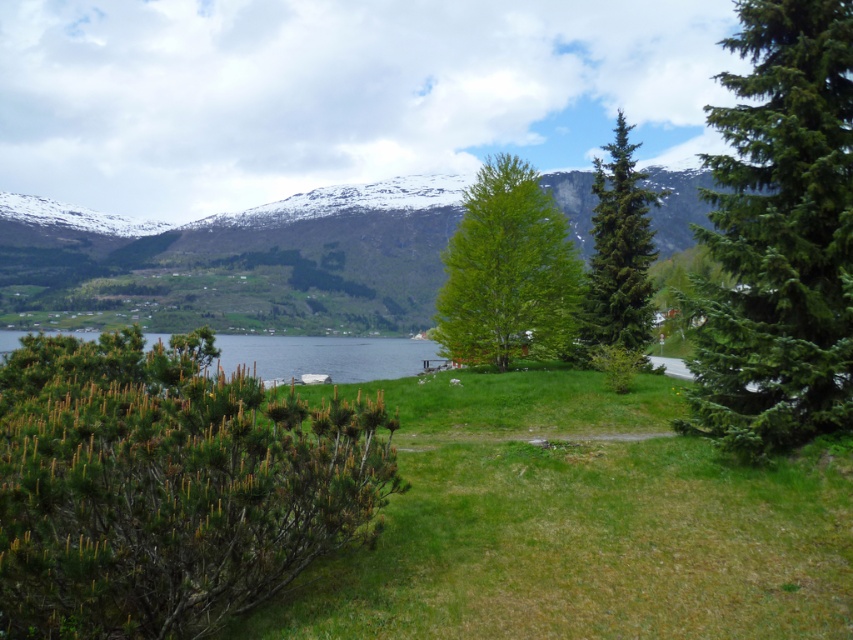
Between point (610, 166) and point (230, 337), which one is positioned in front?

Point (610, 166) is in front.

Between point (630, 202) and point (291, 374), which one is positioned behind?

The point (291, 374) is behind.

At what (x,y) coordinates should I click in order to perform the action: click on green coniferous tree at center. Please return your answer as a coordinate pair (x, y). This screenshot has height=640, width=853. Looking at the image, I should click on (618, 253).

Can you confirm if green leafy tree at center is smaller than green coniferous tree at center?

Incorrect, green leafy tree at center is not smaller in size than green coniferous tree at center.

Measure the distance between green leafy tree at center and camera.

green leafy tree at center and camera are 39.64 meters apart from each other.

The width and height of the screenshot is (853, 640). In order to click on green leafy tree at center in this screenshot , I will do `click(508, 272)`.

How much distance is there between green fir tree at right and green leafy tree at center?

125.83 feet

Between point (763, 214) and point (490, 184), which one is positioned behind?

The point (490, 184) is behind.

Where is `green fir tree at right`? green fir tree at right is located at coordinates (779, 234).